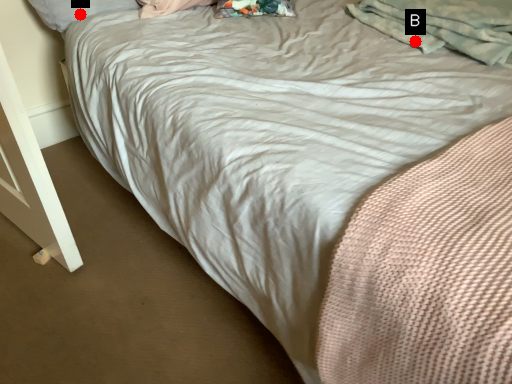
Question: Two points are circled on the image, labeled by A and B beside each circle. Which point appears closest to the camera in this image?

Choices:
 (A) A is closer
 (B) B is closer

Answer: (B)